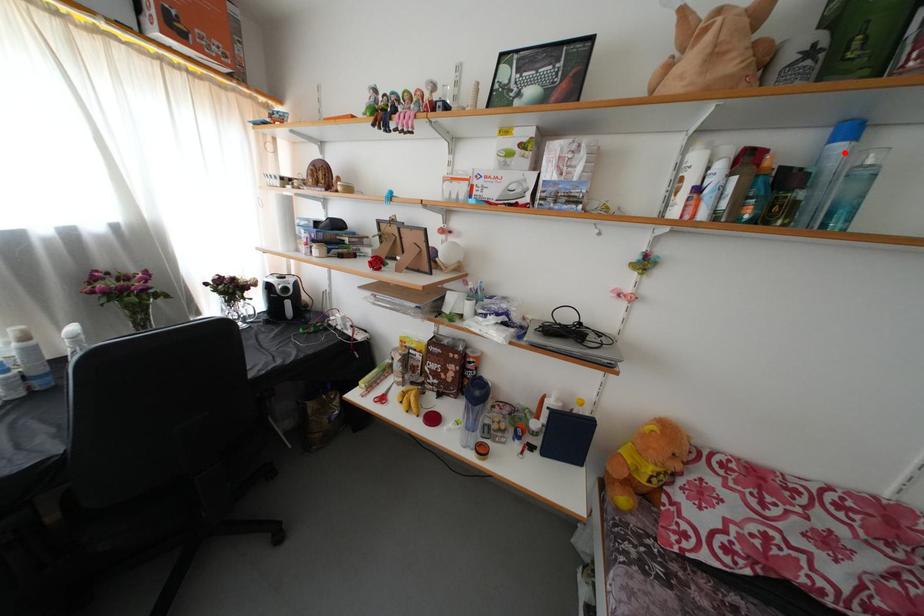
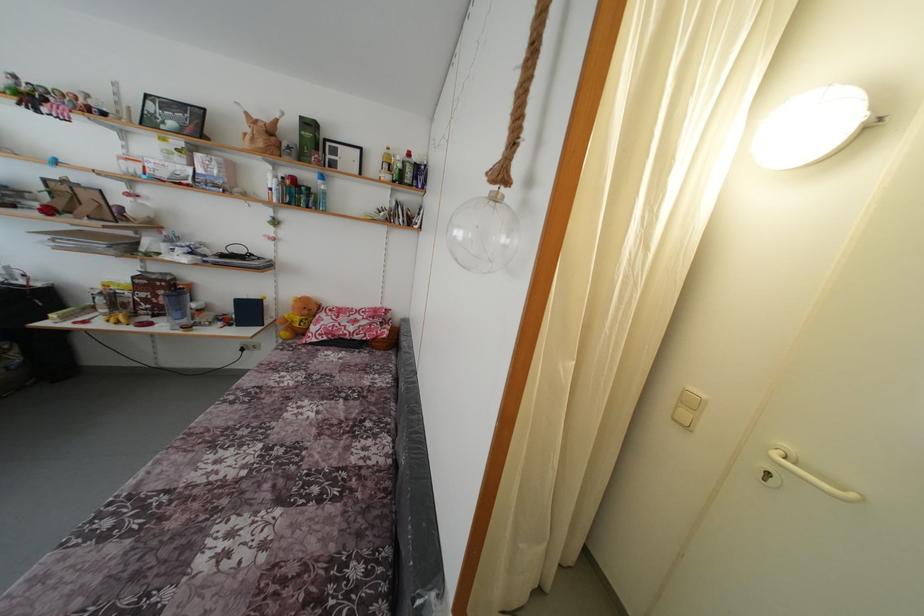
Question: I am providing you with two images of the same scene from different viewpoints. In image1, a red point is highlighted. Considering the same 3D point in image2, which of the following is correct?

Choices:
 (A) It is closer
 (B) It is farther

Answer: (A)